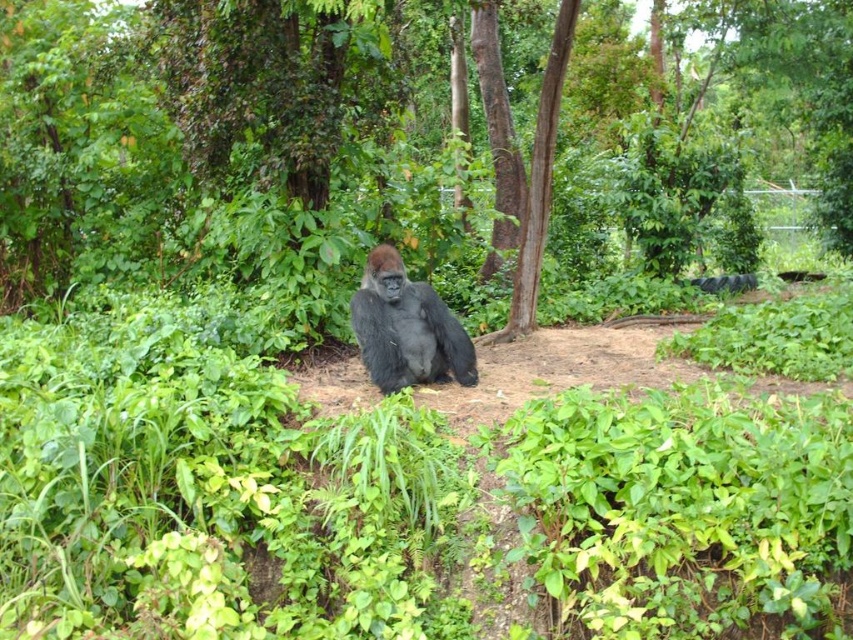
Consider the image. You are a zookeeper planning to place a feeding tray between the dark gray fur gorilla at center and the brown rough tree at center. Based on their widths, which object should the tray be closer to?

The dark gray fur gorilla at center is thinner than the brown rough tree at center, so the feeding tray should be placed closer to the brown rough tree at center to accommodate its wider width.

You are a zookeeper observing the gorilla enclosure. You notice the dark gray fur gorilla at center and the brown rough tree at center. Which object is positioned to the left from your viewpoint?

The dark gray fur gorilla at center is to the left of the brown rough tree at center.